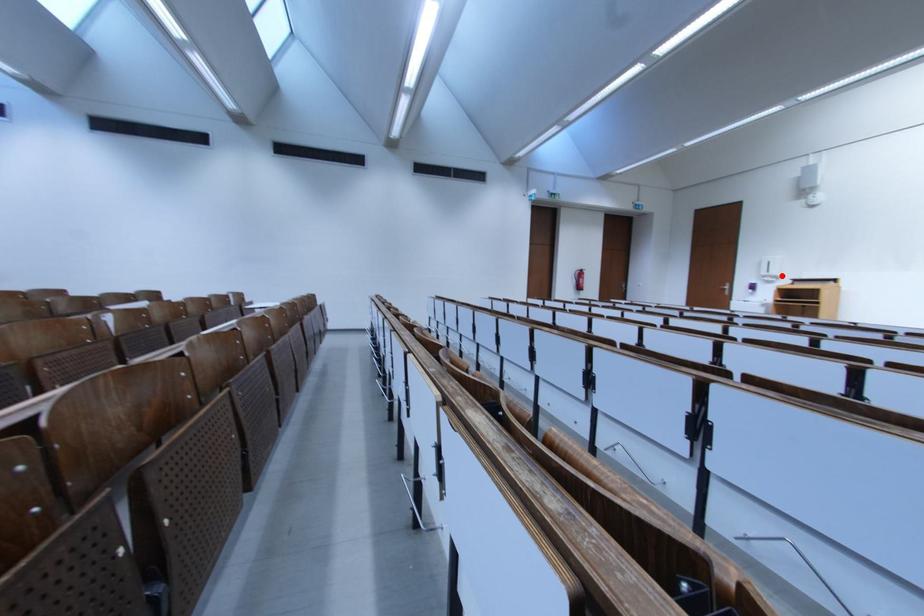
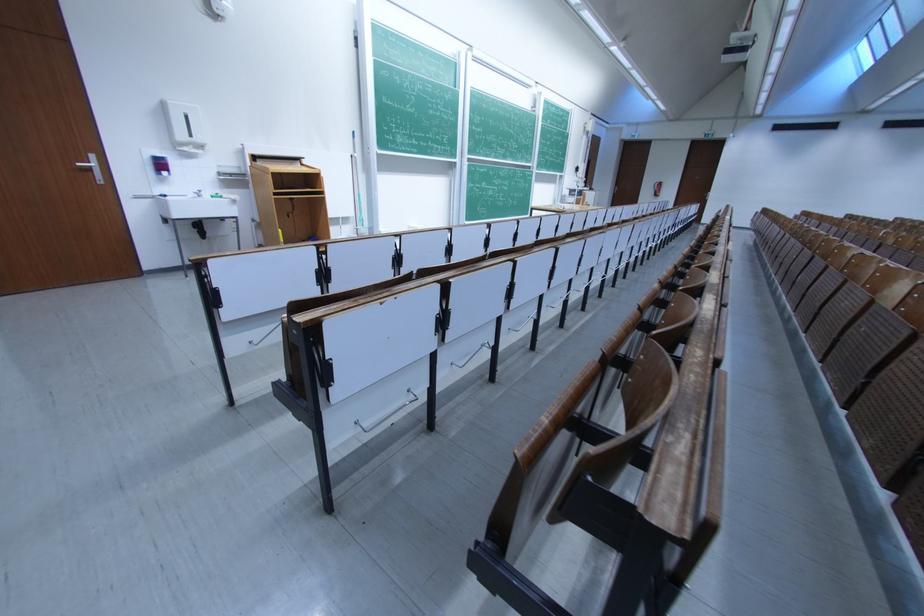
In the second image, find the point that corresponds to the highlighted location in the first image.

(205, 142)